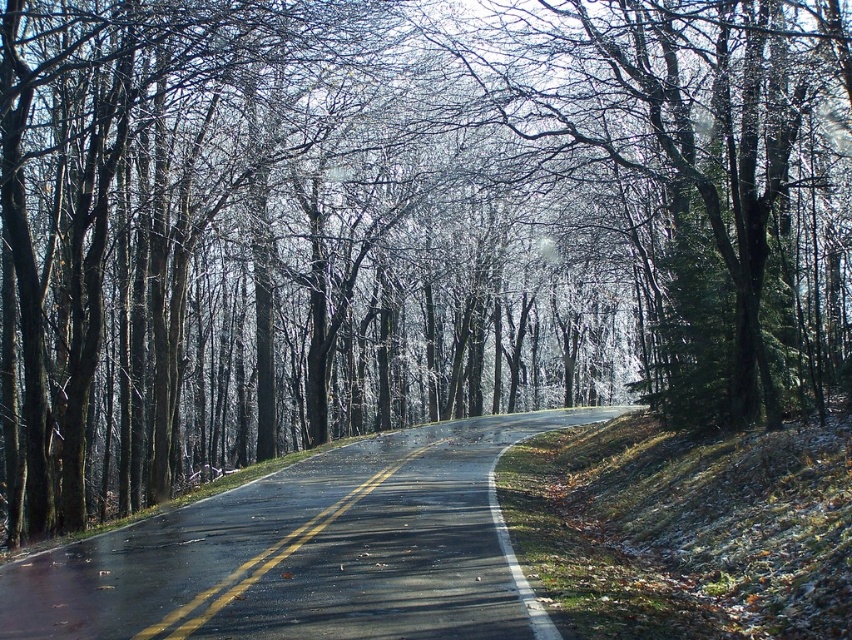
You are driving a car and see the glossy bark tree at center and the black asphalt road at center ahead. Which object is positioned to the right side from your perspective?

The glossy bark tree at center is positioned to the right of the black asphalt road at center.

You are driving a car and see the glossy bark tree at center and the black asphalt road at center ahead. Which one is bigger in size?

The glossy bark tree at center is larger in size compared to the black asphalt road at center.